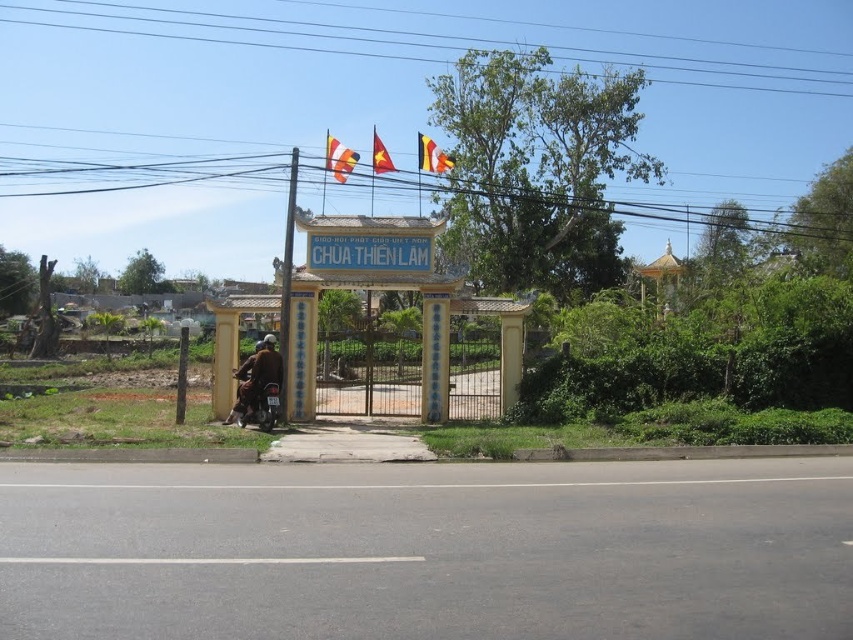
Question: Among these objects, which one is nearest to the camera?

Choices:
 (A) red fabric flag at center
 (B) brown leather jacket at lower left

Answer: (B)

Question: Is metallic wire at upper center positioned before yellow fabric flag at upper center?

Choices:
 (A) yes
 (B) no

Answer: (A)

Question: Is clear blue wires at upper center below white painted wood sign at center?

Choices:
 (A) yes
 (B) no

Answer: (B)

Question: Among these objects, which one is farthest from the camera?

Choices:
 (A) metallic wire at upper center
 (B) clear blue wires at upper center

Answer: (B)

Question: Is white painted wood sign at center wider than orange fabric flag at upper center?

Choices:
 (A) no
 (B) yes

Answer: (A)

Question: Which object appears closest to the camera in this image?

Choices:
 (A) metallic wire at upper center
 (B) orange fabric flag at upper center
 (C) yellow fabric flag at upper center
 (D) brown leather jacket at lower left

Answer: (D)